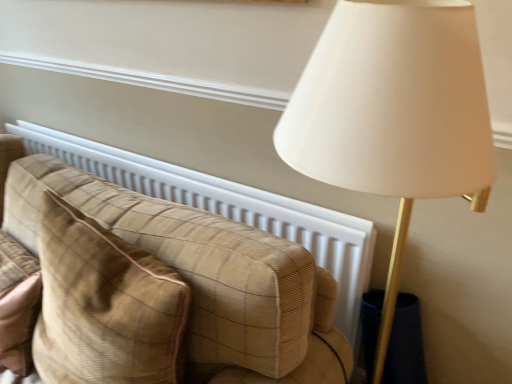
This screenshot has width=512, height=384. What do you see at coordinates (204, 275) in the screenshot? I see `plaid fabric couch at center` at bounding box center [204, 275].

Image resolution: width=512 pixels, height=384 pixels. I want to click on plaid fabric couch at center, so click(x=204, y=275).

This screenshot has height=384, width=512. Find the location of `plaid fabric pillow at left`. plaid fabric pillow at left is located at coordinates (104, 305).

The width and height of the screenshot is (512, 384). What do you see at coordinates (104, 305) in the screenshot? I see `plaid fabric pillow at left` at bounding box center [104, 305].

Measure the distance between point (60, 359) and camera.

They are 37.87 inches apart.

I want to click on plaid fabric couch at center, so click(x=204, y=275).

Can you confirm if plaid fabric pillow at left is positioned to the right of plaid fabric couch at center?

Yes, plaid fabric pillow at left is to the right of plaid fabric couch at center.

In the image, is plaid fabric pillow at left positioned in front of or behind plaid fabric couch at center?

plaid fabric pillow at left is positioned closer to the viewer than plaid fabric couch at center.

Which point is more forward, [51,263] or [292,276]?

The point [292,276] is closer to the camera.

From the image's perspective, between plaid fabric pillow at left and plaid fabric couch at center, which one is located above?

From the image's view, plaid fabric couch at center is above.

From a real-world perspective, which is physically below, plaid fabric pillow at left or plaid fabric couch at center?

plaid fabric couch at center.

Which object is wider, plaid fabric pillow at left or plaid fabric couch at center?

Wider between the two is plaid fabric pillow at left.

Is plaid fabric pillow at left shorter than plaid fabric couch at center?

Correct, plaid fabric pillow at left is not as tall as plaid fabric couch at center.

Considering the relative sizes of plaid fabric pillow at left and plaid fabric couch at center in the image provided, is plaid fabric pillow at left bigger than plaid fabric couch at center?

Incorrect, plaid fabric pillow at left is not larger than plaid fabric couch at center.

Does plaid fabric pillow at left contain plaid fabric couch at center?

No, plaid fabric couch at center is not surrounded by plaid fabric pillow at left.

Is plaid fabric pillow at left next to plaid fabric couch at center and touching it?

plaid fabric pillow at left is not next to plaid fabric couch at center, and they're not touching.

Is plaid fabric pillow at left looking in the opposite direction of plaid fabric couch at center?

Yes, plaid fabric pillow at left's orientation is away from plaid fabric couch at center.

How much distance is there between plaid fabric pillow at left and plaid fabric couch at center?

7.38 inches.

The height and width of the screenshot is (384, 512). Find the location of `throw pillow that appears above the plaid fabric couch at center (from a real-world perspective)`. throw pillow that appears above the plaid fabric couch at center (from a real-world perspective) is located at coordinates (104, 305).

Is plaid fabric couch at center to the left of plaid fabric pillow at left from the viewer's perspective?

Yes, plaid fabric couch at center is to the left of plaid fabric pillow at left.

Is plaid fabric couch at center in front of or behind plaid fabric pillow at left in the image?

plaid fabric couch at center is positioned farther from the viewer than plaid fabric pillow at left.

Considering the points (6, 181) and (46, 379), which point is behind, point (6, 181) or point (46, 379)?

Positioned behind is point (6, 181).

From the image's perspective, which is below, plaid fabric couch at center or plaid fabric pillow at left?

plaid fabric pillow at left.

From a real-world perspective, between plaid fabric couch at center and plaid fabric pillow at left, who is vertically higher?

plaid fabric pillow at left, from a real-world perspective.

Considering the sizes of objects plaid fabric couch at center and plaid fabric pillow at left in the image provided, who is thinner, plaid fabric couch at center or plaid fabric pillow at left?

With smaller width is plaid fabric couch at center.

Considering the sizes of plaid fabric couch at center and plaid fabric pillow at left in the image, is plaid fabric couch at center taller or shorter than plaid fabric pillow at left?

Clearly, plaid fabric couch at center is taller compared to plaid fabric pillow at left.

Based on their sizes in the image, would you say plaid fabric couch at center is bigger or smaller than plaid fabric pillow at left?

Considering their sizes, plaid fabric couch at center takes up more space than plaid fabric pillow at left.

Is plaid fabric couch at center not inside plaid fabric pillow at left?

That's correct, plaid fabric couch at center is outside of plaid fabric pillow at left.

Is plaid fabric couch at center not close to plaid fabric pillow at left?

plaid fabric couch at center is near plaid fabric pillow at left, not far away.

Is plaid fabric couch at center looking in the opposite direction of plaid fabric pillow at left?

No.

Identify the location of throw pillow on the right of plaid fabric couch at center. (104, 305).

Where is `throw pillow above the plaid fabric couch at center (from a real-world perspective)`? The width and height of the screenshot is (512, 384). throw pillow above the plaid fabric couch at center (from a real-world perspective) is located at coordinates (x=104, y=305).

I want to click on studio couch that is under the plaid fabric pillow at left (from a real-world perspective), so click(x=204, y=275).